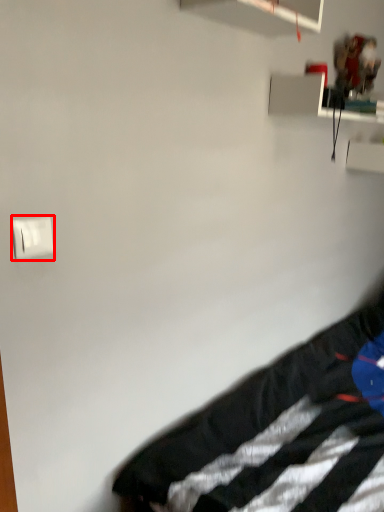
Question: From the image's perspective, where is light switch (annotated by the red box) located in relation to furniture in the image?

Choices:
 (A) below
 (B) above

Answer: (B)